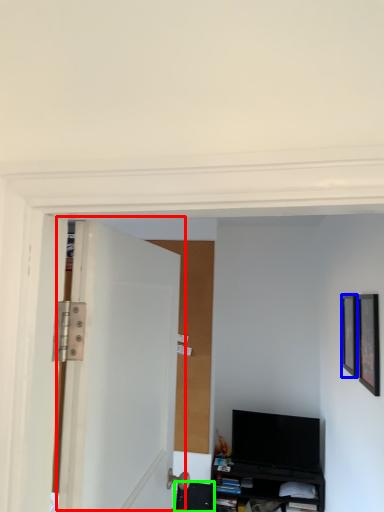
Question: Which object is positioned farthest from door (highlighted by a red box)? Select from picture frame (highlighted by a blue box) and shelf (highlighted by a green box).

Choices:
 (A) picture frame
 (B) shelf

Answer: (B)